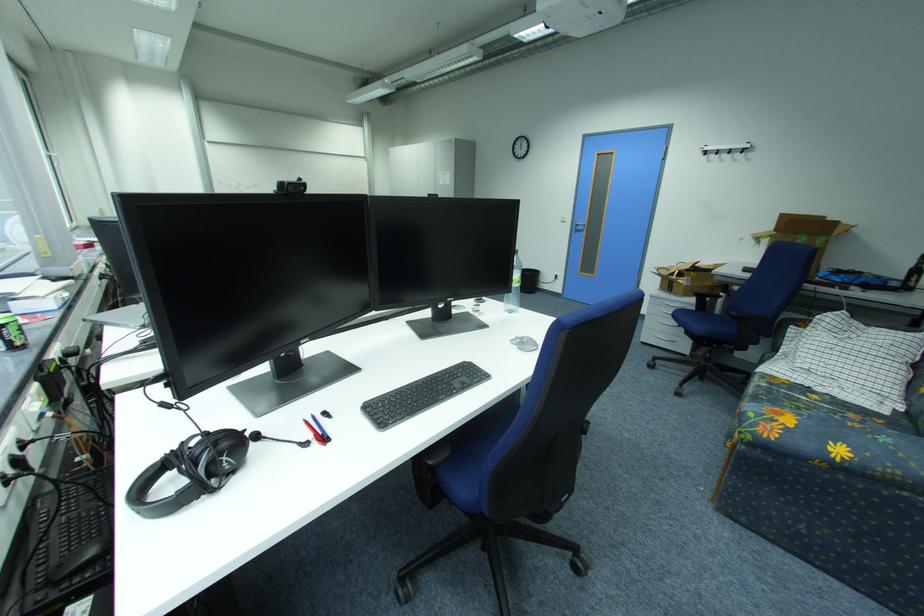
The width and height of the screenshot is (924, 616). Describe the element at coordinates (578, 225) in the screenshot. I see `a silver door handle` at that location.